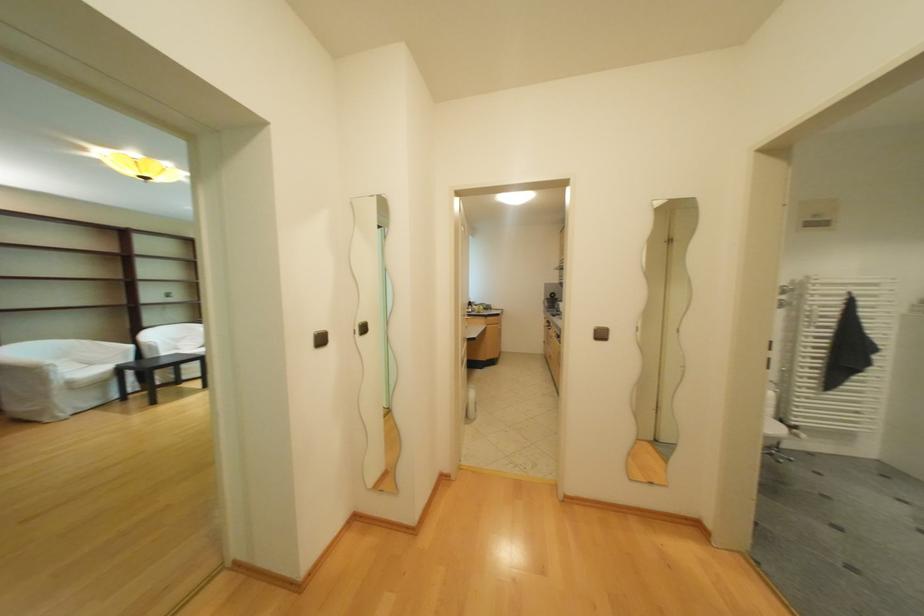
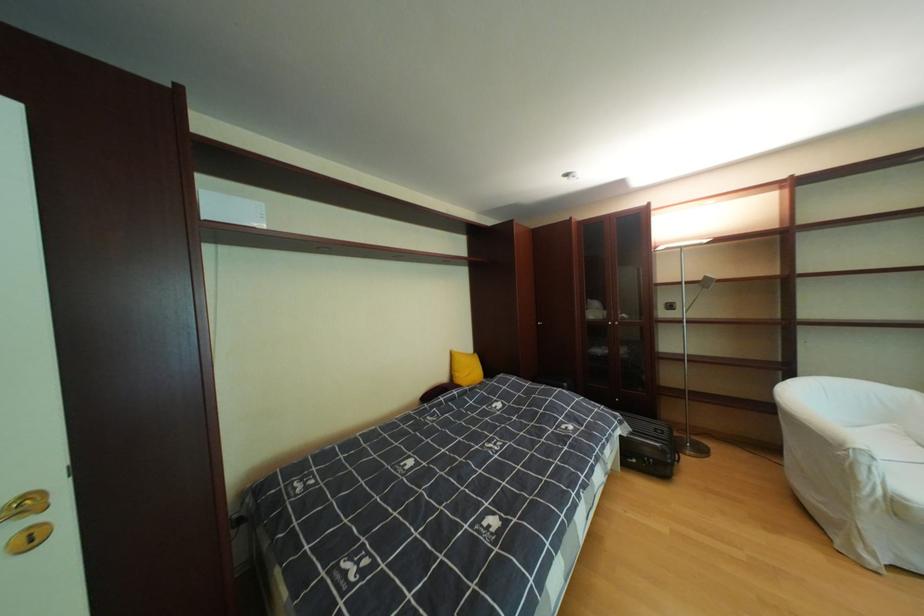
In the second image, find the point that corresponds to (x=82, y=384) in the first image.

(908, 506)